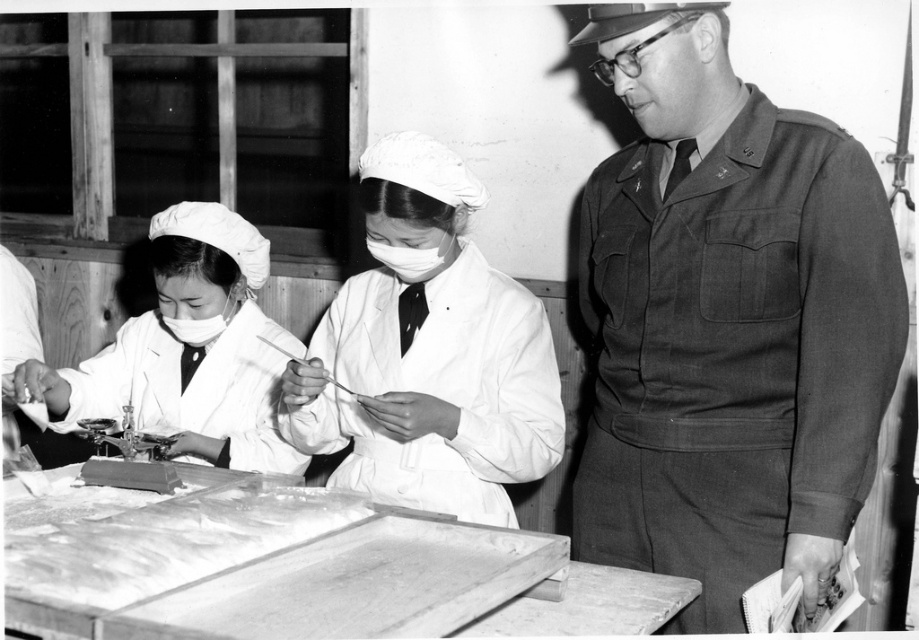
From the picture: You are a photographer analyzing this historical black and white image. You notice the white matte lab coat at center and the white matte mask at center. Which object occupies more vertical space in the image?

The white matte lab coat at center has a greater height compared to the white matte mask at center, so it occupies more vertical space in the image.

You are standing in front of the table where the two individuals are working with the balance scale. There is a wooden tray at lower center marked by point (291, 570). Can you tell me what is the position of the wooden tray at lower center relative to the two individuals in white lab coats?

The wooden tray at lower center marked by point (291, 570) is located between the two individuals in white lab coats.

You are a photographer analyzing the composition of this black and white image. You notice the white matte lab coat at center and the white matte mask at center. Which object occupies more horizontal space in the image?

The white matte lab coat at center might be wider than white matte mask at center, so it likely occupies more horizontal space in the image.